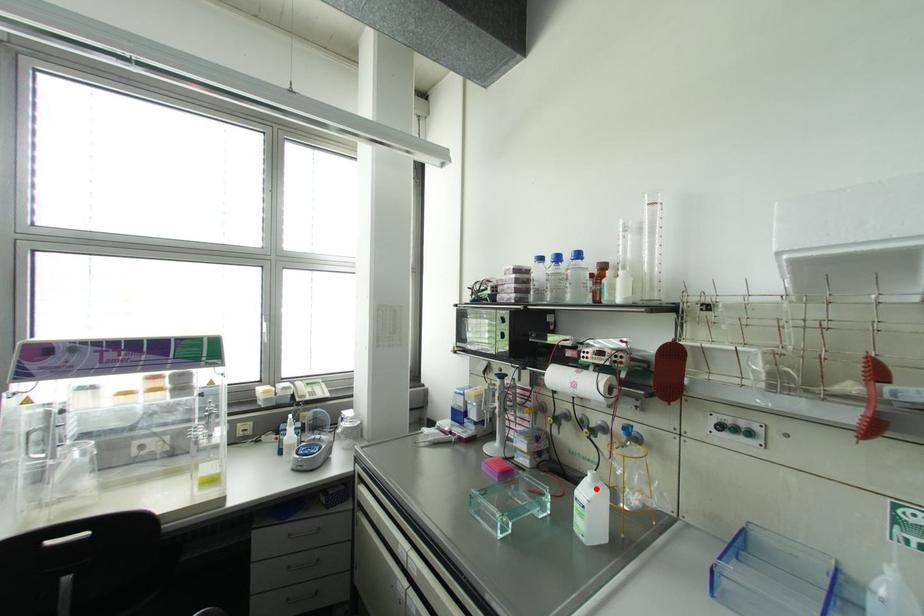
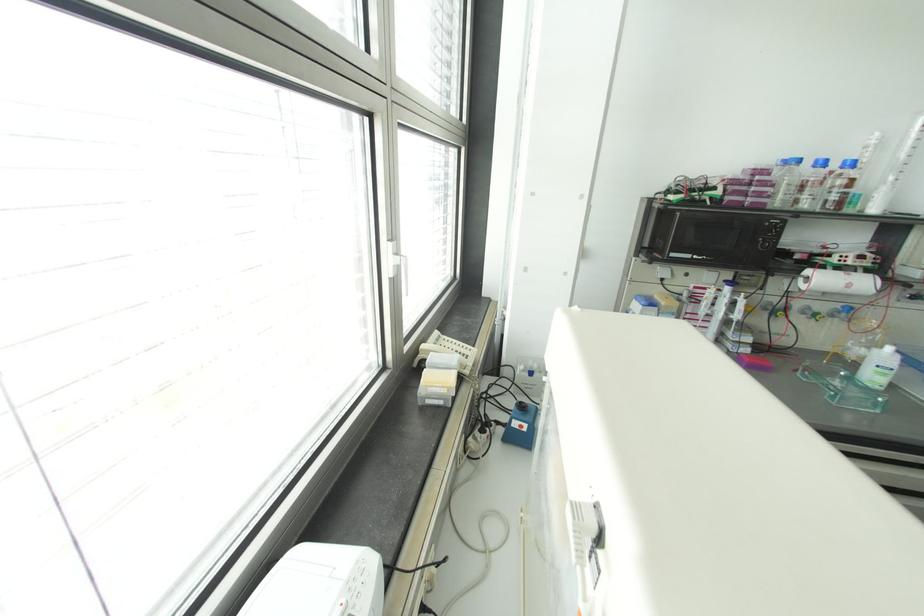
In the second image, find the point that corresponds to the highlighted location in the first image.

(898, 355)